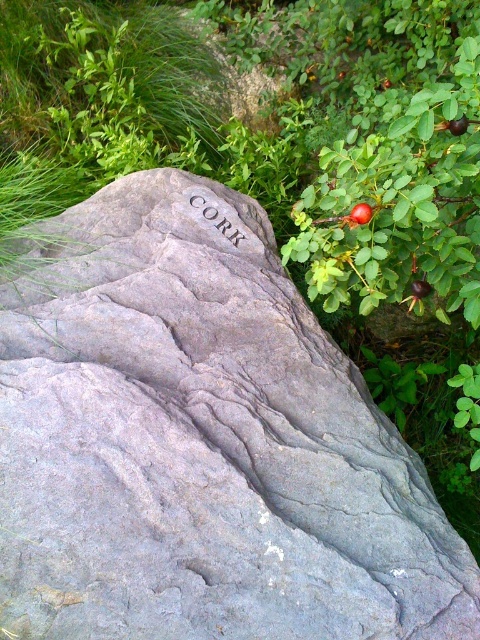
You are a gardener standing in front of the gray rock at center and the shiny red rosehip at upper right. Which object is positioned to the right side of the image?

The shiny red rosehip at upper right is positioned to the right side of the image.